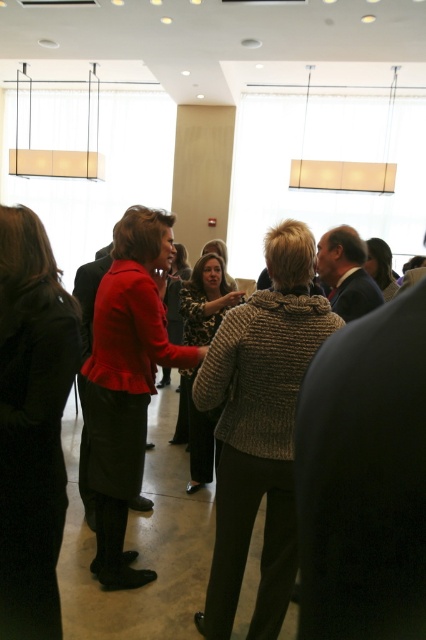
Question: In this image, where is knitted sweater at center located relative to black wool coat at left?

Choices:
 (A) right
 (B) left

Answer: (A)

Question: Which object is the closest to the dark brown textured sweater at center?

Choices:
 (A) knitted sweater at center
 (B) camouflage-patterned sweater at center
 (C) matte red blazer at center

Answer: (B)

Question: Which point is farther to the camera?

Choices:
 (A) (264, 611)
 (B) (48, 248)

Answer: (A)

Question: Does knitted sweater at center appear on the right side of matte red blazer at center?

Choices:
 (A) yes
 (B) no

Answer: (A)

Question: Does matte red blazer at center appear on the right side of dark brown textured sweater at center?

Choices:
 (A) no
 (B) yes

Answer: (A)

Question: Which point is farther to the camera?

Choices:
 (A) (370, 273)
 (B) (279, 225)

Answer: (A)